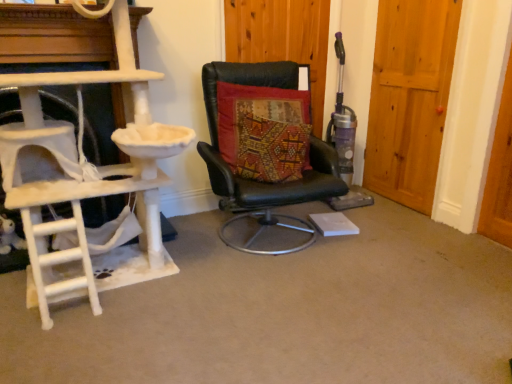
Question: Looking at their shapes, would you say wooden door at center, the 2th door positioned from the right, is wider or thinner than textured multicolored cushion at center?

Choices:
 (A) thin
 (B) wide

Answer: (A)

Question: Which is correct: wooden door at center, the 2th door positioned from the right, is inside textured multicolored cushion at center, or outside of it?

Choices:
 (A) inside
 (B) outside

Answer: (B)

Question: Which of these objects is positioned farthest from the wooden door at center, the 2th door positioned from the right?

Choices:
 (A) white carpeted ladder at left
 (B) wooden door at right, which appears as the 1th door when viewed from the right
 (C) textured multicolored cushion at center
 (D) black leather chair at center

Answer: (A)

Question: Estimate the real-world distances between objects in this image. Which object is closer to the white carpeted ladder at left?

Choices:
 (A) wooden door at right, arranged as the 2th door when viewed from the left
 (B) wooden door at center, the 1th door positioned from the left
 (C) textured multicolored cushion at center
 (D) black leather chair at center

Answer: (D)